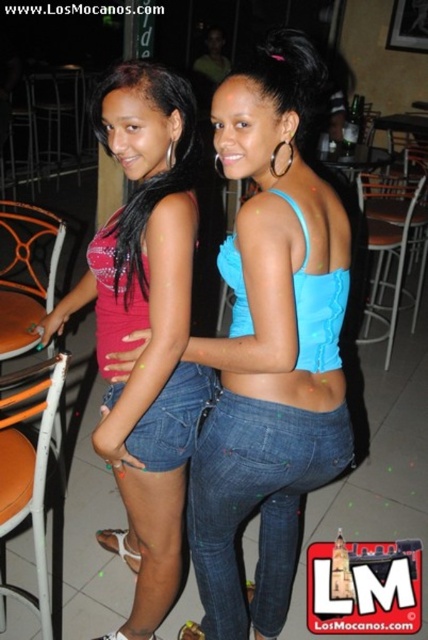
Between point (160, 440) and point (41, 108), which one is positioned behind?

The point (41, 108) is behind.

Where is `denim jeans at center`? denim jeans at center is located at coordinates (174, 419).

Is blue denim shorts at center in front of orange metal chair at left?

Yes, it is.

Between point (238, 298) and point (14, 289), which one is positioned behind?

Point (14, 289)

Locate an element on the screen. blue denim shorts at center is located at coordinates (270, 346).

Does blue denim jeans at center appear under denim jeans at center?

Indeed, blue denim jeans at center is positioned under denim jeans at center.

Who is taller, blue denim jeans at center or denim jeans at center?

blue denim jeans at center

Who is more forward, [247,416] or [183,394]?

Point [247,416] is more forward.

Locate an element on the screen. The width and height of the screenshot is (428, 640). blue denim jeans at center is located at coordinates (255, 502).